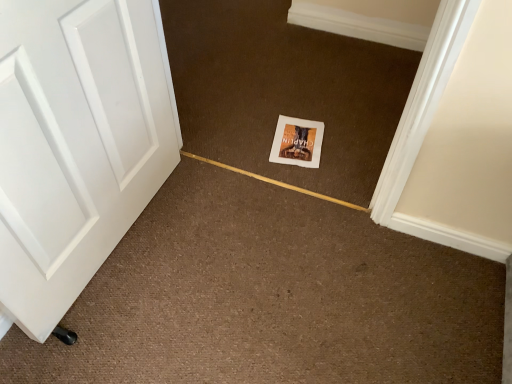
Question: Is white paper postcard at center positioned far away from white matte book at center?

Choices:
 (A) yes
 (B) no

Answer: (B)

Question: Can you confirm if white paper postcard at center is wider than white matte book at center?

Choices:
 (A) no
 (B) yes

Answer: (A)

Question: Considering the relative sizes of white paper postcard at center and white matte book at center in the image provided, is white paper postcard at center bigger than white matte book at center?

Choices:
 (A) no
 (B) yes

Answer: (A)

Question: Considering the relative positions of white paper postcard at center and white matte book at center in the image provided, is white paper postcard at center behind white matte book at center?

Choices:
 (A) no
 (B) yes

Answer: (B)

Question: Does white paper postcard at center lie in front of white matte book at center?

Choices:
 (A) yes
 (B) no

Answer: (B)

Question: Is the surface of white paper postcard at center in direct contact with white matte book at center?

Choices:
 (A) no
 (B) yes

Answer: (A)

Question: Is white matte book at center closer to the viewer compared to white paper postcard at center?

Choices:
 (A) yes
 (B) no

Answer: (A)

Question: Is white matte book at center next to white paper postcard at center and touching it?

Choices:
 (A) yes
 (B) no

Answer: (B)

Question: Is white matte book at center oriented towards white paper postcard at center?

Choices:
 (A) no
 (B) yes

Answer: (B)

Question: Is white matte book at center to the right of white paper postcard at center from the viewer's perspective?

Choices:
 (A) yes
 (B) no

Answer: (B)

Question: From a real-world perspective, is white matte book at center below white paper postcard at center?

Choices:
 (A) no
 (B) yes

Answer: (A)

Question: Is the position of white matte book at center more distant than that of white paper postcard at center?

Choices:
 (A) yes
 (B) no

Answer: (B)

Question: Which is correct: white paper postcard at center is inside white matte book at center, or outside of it?

Choices:
 (A) outside
 (B) inside

Answer: (B)